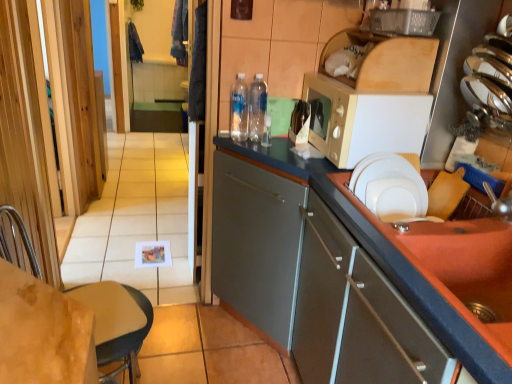
Question: From the image's perspective, is clear plastic bottles at center, which appears as the second bottle when viewed from the right, over blue fabric laundry at upper left, the 2th laundry positioned from the left?

Choices:
 (A) no
 (B) yes

Answer: (A)

Question: Can you confirm if clear plastic bottles at center, which appears as the second bottle when viewed from the right, is positioned to the right of blue fabric laundry at upper left, the 2th laundry positioned from the left?

Choices:
 (A) yes
 (B) no

Answer: (A)

Question: From a real-world perspective, does clear plastic bottles at center, which appears as the second bottle when viewed from the right, stand above blue fabric laundry at upper left, the 2th laundry positioned from the left?

Choices:
 (A) yes
 (B) no

Answer: (B)

Question: Is clear plastic bottles at center, which appears as the second bottle when viewed from the right, thinner than blue fabric laundry at upper left, the 2th laundry positioned from the left?

Choices:
 (A) yes
 (B) no

Answer: (A)

Question: Is blue fabric laundry at upper left, positioned as the 1th laundry in front-to-back order, inside clear plastic bottles at center, positioned as the second bottle in left-to-right order?

Choices:
 (A) no
 (B) yes

Answer: (A)

Question: Is clear plastic bottles at center, positioned as the second bottle in left-to-right order, in front of or behind white matte microwave at upper right in the image?

Choices:
 (A) front
 (B) behind

Answer: (B)

Question: Considering the positions of clear plastic bottles at center, positioned as the second bottle in left-to-right order, and white matte microwave at upper right in the image, is clear plastic bottles at center, positioned as the second bottle in left-to-right order, taller or shorter than white matte microwave at upper right?

Choices:
 (A) short
 (B) tall

Answer: (A)

Question: From the image's perspective, is clear plastic bottles at center, which appears as the second bottle when viewed from the right, positioned above or below white matte microwave at upper right?

Choices:
 (A) above
 (B) below

Answer: (A)

Question: Considering the positions of clear plastic bottles at center, positioned as the second bottle in left-to-right order, and white matte microwave at upper right in the image, is clear plastic bottles at center, positioned as the second bottle in left-to-right order, wider or thinner than white matte microwave at upper right?

Choices:
 (A) wide
 (B) thin

Answer: (B)

Question: Considering the relative positions of white matte microwave at upper right and clear plastic bottles at center, which appears as the second bottle when viewed from the right, in the image provided, is white matte microwave at upper right to the left or to the right of clear plastic bottles at center, which appears as the second bottle when viewed from the right,?

Choices:
 (A) right
 (B) left

Answer: (A)

Question: Is white matte microwave at upper right bigger or smaller than clear plastic bottles at center, positioned as the second bottle in left-to-right order?

Choices:
 (A) big
 (B) small

Answer: (A)

Question: Is point (337, 139) closer or farther from the camera than point (257, 129)?

Choices:
 (A) farther
 (B) closer

Answer: (B)

Question: Considering the positions of white matte microwave at upper right and clear plastic bottles at center, positioned as the second bottle in left-to-right order, in the image, is white matte microwave at upper right wider or thinner than clear plastic bottles at center, positioned as the second bottle in left-to-right order,?

Choices:
 (A) thin
 (B) wide

Answer: (B)

Question: Is matte gray cabinet at right, which is counted as the second cabinetry, starting from the front, in front of or behind transparent wooden screen door at left in the image?

Choices:
 (A) front
 (B) behind

Answer: (A)

Question: From a real-world perspective, relative to transparent wooden screen door at left, is matte gray cabinet at right, which is counted as the second cabinetry, starting from the front, vertically above or below?

Choices:
 (A) above
 (B) below

Answer: (B)